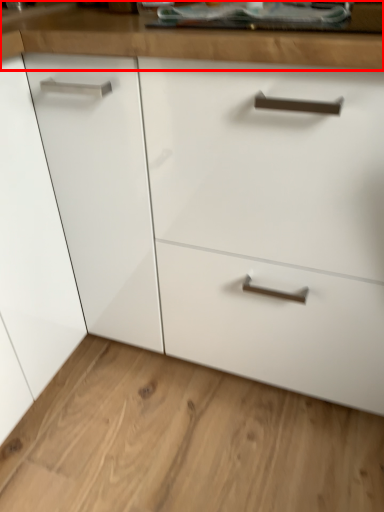
Question: Observing the image, what is the correct spatial positioning of counter top (annotated by the red box) in reference to plain?

Choices:
 (A) right
 (B) left

Answer: (A)